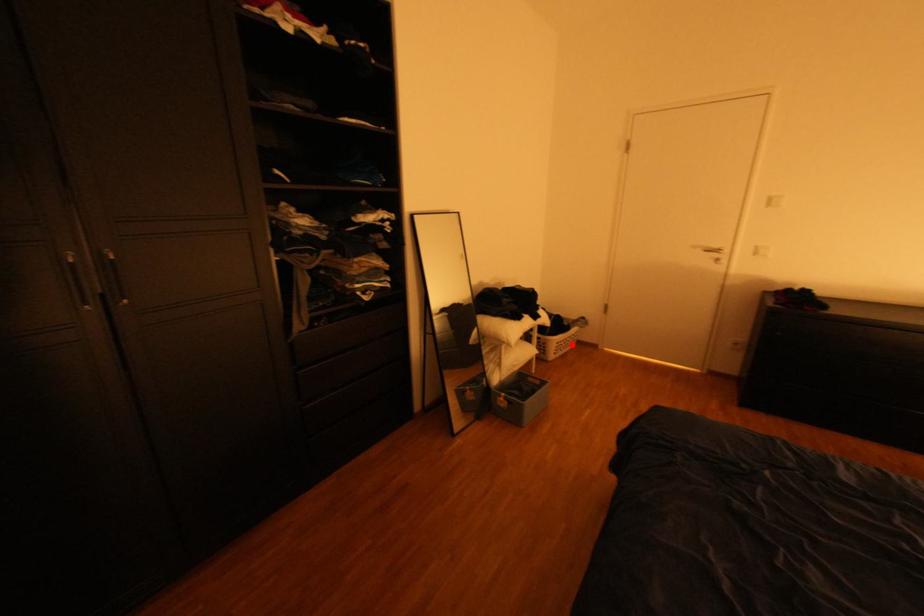
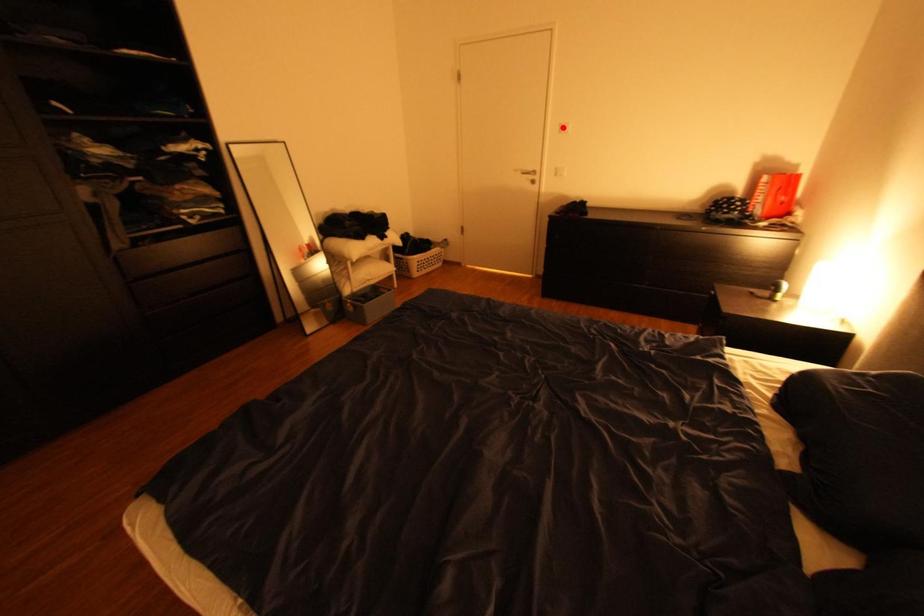
I am providing you with two images of the same scene from different viewpoints. A red point is marked on the first image and another point is marked on the second image. Are the points marked in image1 and image2 representing the same 3D position?

No